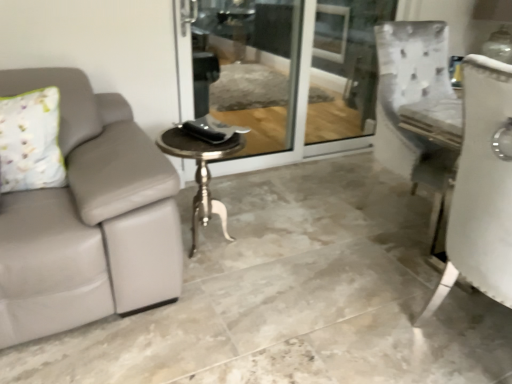
Question: From the image's perspective, relative to polished silver table at center, is floral fabric pillow at left above or below?

Choices:
 (A) above
 (B) below

Answer: (A)

Question: Considering the positions of floral fabric pillow at left and polished silver table at center in the image, is floral fabric pillow at left taller or shorter than polished silver table at center?

Choices:
 (A) tall
 (B) short

Answer: (B)

Question: Which of these objects is positioned farthest from the floral fabric pillow at left?

Choices:
 (A) clear glass screen door at center
 (B) polished silver table at center
 (C) gray leather couch at left

Answer: (A)

Question: Estimate the real-world distances between objects in this image. Which object is closer to the polished silver table at center?

Choices:
 (A) floral fabric pillow at left
 (B) clear glass screen door at center
 (C) gray leather couch at left

Answer: (C)